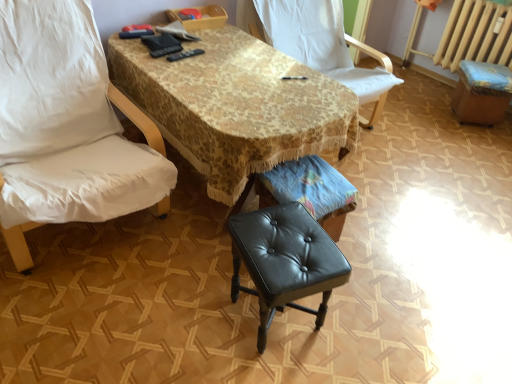
Question: Considering the relative positions of black leather stool at center and gold lace tablecloth at center in the image provided, is black leather stool at center to the left or to the right of gold lace tablecloth at center?

Choices:
 (A) left
 (B) right

Answer: (B)

Question: Would you say black leather stool at center is inside or outside gold lace tablecloth at center?

Choices:
 (A) inside
 (B) outside

Answer: (B)

Question: Estimate the real-world distances between objects in this image. Which object is closer to the white fabric chair at center, the first chair positioned from the right?

Choices:
 (A) gold lace tablecloth at center
 (B) black leather music stool at center
 (C) black leather bar stool at lower right
 (D) white fabric chair at left, which appears as the first chair when viewed from the left
 (E) black leather stool at center

Answer: (A)

Question: Which object is positioned farthest from the black leather stool at center?

Choices:
 (A) black leather music stool at center
 (B) black leather bar stool at lower right
 (C) white fabric chair at left, which appears as the first chair when viewed from the left
 (D) gold lace tablecloth at center
 (E) white fabric chair at center, the second chair viewed from the left

Answer: (B)